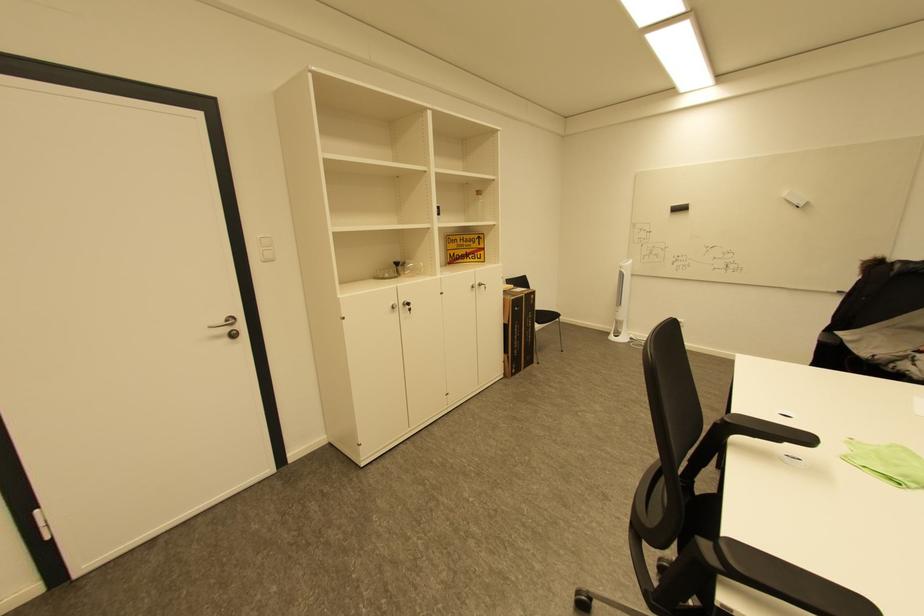
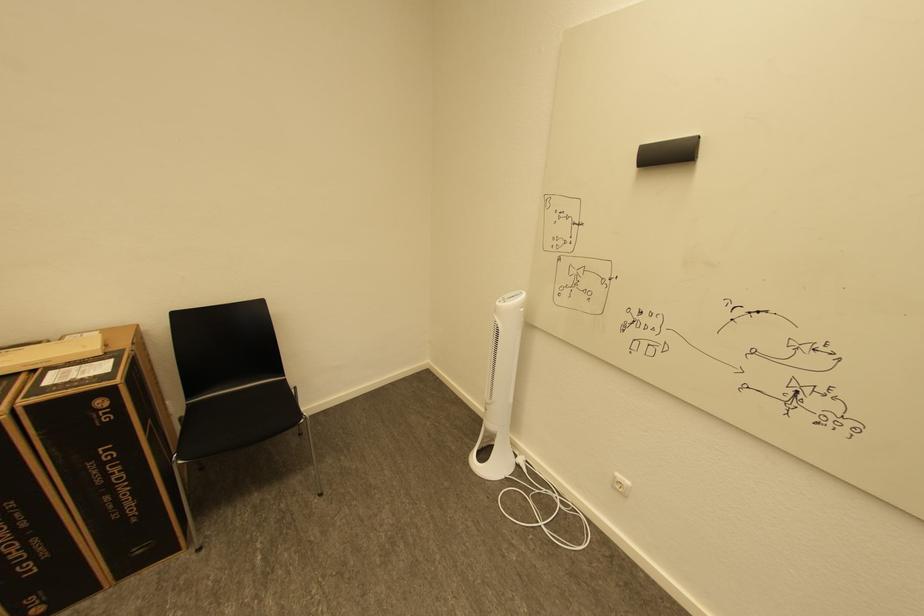
The images are taken continuously from a first-person perspective. In which direction are you moving?

The cameraman moved toward right, forward.